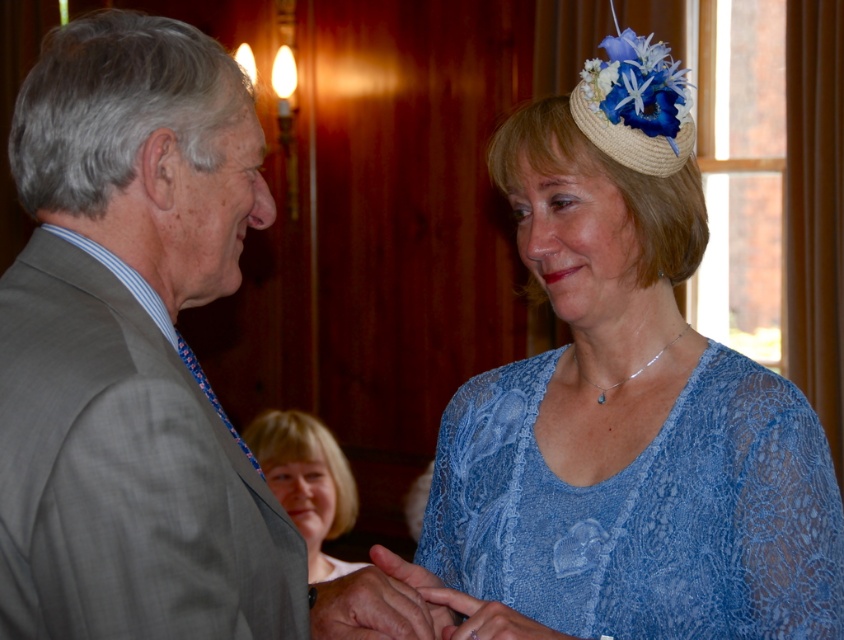
You are an artist sketching this scene and want to ensure proportions are correct. Which object is shorter in height between the lacy blue dress at center and the blonde hair at lower center?

The lacy blue dress at center is shorter in height than the blonde hair at lower center.

In the scene shown: You are standing in front of the scene and need to locate the lacy blue dress at center. According to the coordinates provided, where exactly is it positioned?

The lacy blue dress at center is located at point (644, 513).

You are a photographer at a formal event. You need to capture a closeup shot of the lacy blue dress at center and the matte blue lace hand at center. Which object should you focus on first if you want to ensure both are in focus without adjusting the camera settings?

The lacy blue dress at center is taller than the matte blue lace hand at center. To keep both in focus, focus on the lacy blue dress at center first since it is farther away, allowing the depth of field to cover the closer hand.